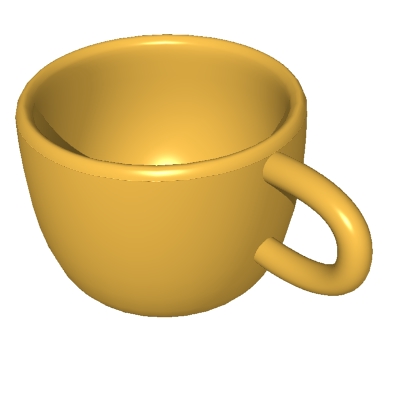
This screenshot has height=400, width=400. In order to click on handle in this screenshot , I will do `click(348, 268)`.